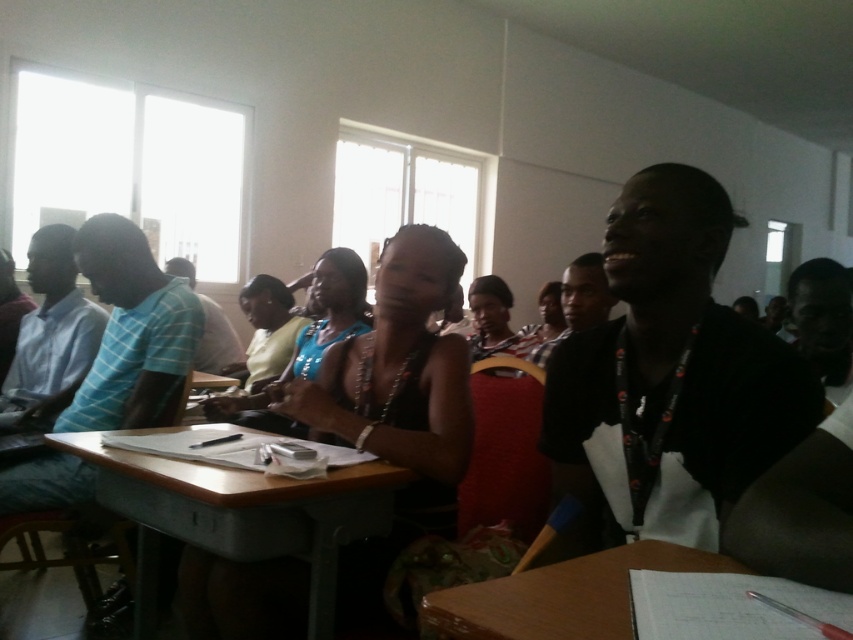
You are organizing a photo shoot in the classroom and need to ensure that the black beaded necklace at center and the matte black tank top at center are visible in the frame. Based on their sizes, which item would require more horizontal space in the photo to fully capture its width?

The black beaded necklace at center requires more horizontal space in the photo because its width surpasses that of the matte black tank top at center.

You are standing in the classroom and want to locate two specific points marked on the desk. The first point is at coordinates point (332, 266) and the second is at point (556, 280). Which point is closer to you?

Point (332, 266) is closer to the viewer than point (556, 280).

You are a photographer trying to capture a closeup of the black beaded necklace at center and the matte black tank top at center. Which object should you zoom in on to ensure it fills the frame better?

The black beaded necklace at center has a larger size compared to the matte black tank top at center, so zooming in on the black beaded necklace at center will fill the frame better.